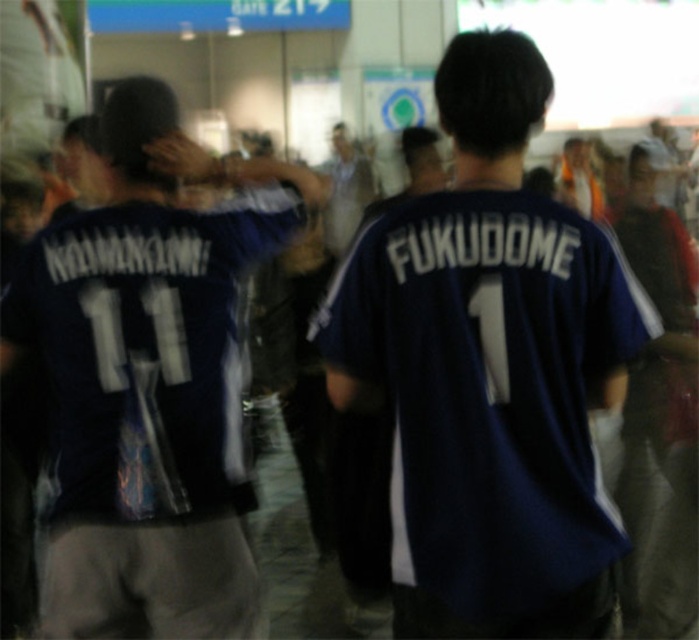
Does dark blue jersey at center have a greater height compared to blue jersey at center?

No, dark blue jersey at center is not taller than blue jersey at center.

Can you confirm if dark blue jersey at center is shorter than blue jersey at center?

Yes, dark blue jersey at center is shorter than blue jersey at center.

The height and width of the screenshot is (640, 699). What do you see at coordinates (490, 371) in the screenshot? I see `dark blue jersey at center` at bounding box center [490, 371].

I want to click on dark blue jersey at center, so click(490, 371).

Between dark blue jersey at center and matte blue jersey at center, which one is positioned lower?

matte blue jersey at center is lower down.

From the picture: Which of these two, dark blue jersey at center or matte blue jersey at center, stands taller?

With more height is matte blue jersey at center.

Where is `dark blue jersey at center`? This screenshot has height=640, width=699. dark blue jersey at center is located at coordinates (490, 371).

Which is more to the left, matte blue jersey at center or blue jersey at center?

matte blue jersey at center

Between matte blue jersey at center and blue jersey at center, which one has less height?

matte blue jersey at center

Which is behind, point (208, 604) or point (338, 193)?

Positioned behind is point (338, 193).

The height and width of the screenshot is (640, 699). In order to click on matte blue jersey at center in this screenshot , I will do `click(150, 381)`.